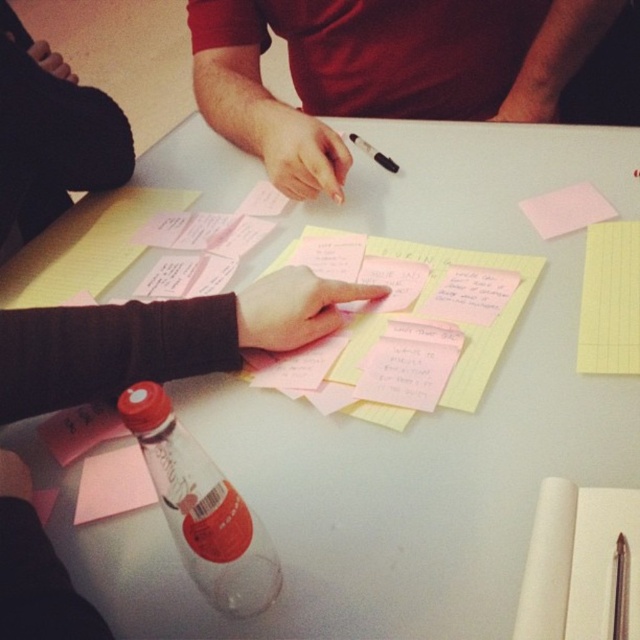
You are part of the brainstorming team and need to place a new sticky note to the right of the clear plastic bottle at lower left. Where should you place it relative to the pink paper at upper right?

You should place the new sticky note to the right of the clear plastic bottle at lower left, which would be to the left of the pink paper at upper right since the clear plastic bottle at lower left is already positioned to the left of the pink paper at upper right.

You are a participant in the brainstorming session and need to place a 12 inch ruler between the white paper notepad at lower right and the pink paper at upper right. Will the ruler fit perfectly between them without overlapping either paper?

The distance between the white paper notepad at lower right and the pink paper at upper right is 14.72 inches. Since the ruler is only 12 inches long, it will fit perfectly between them without overlapping either paper as there is extra space.

You are a new member joining the brainstorming session. You want to introduce yourself to the person wearing the matte red shirt at center without disturbing the ongoing activity. Which direction should you approach from relative to the pink paper at lower left?

You should approach from the right side of the pink paper at lower left because the matte red shirt at center is located to the right of it.